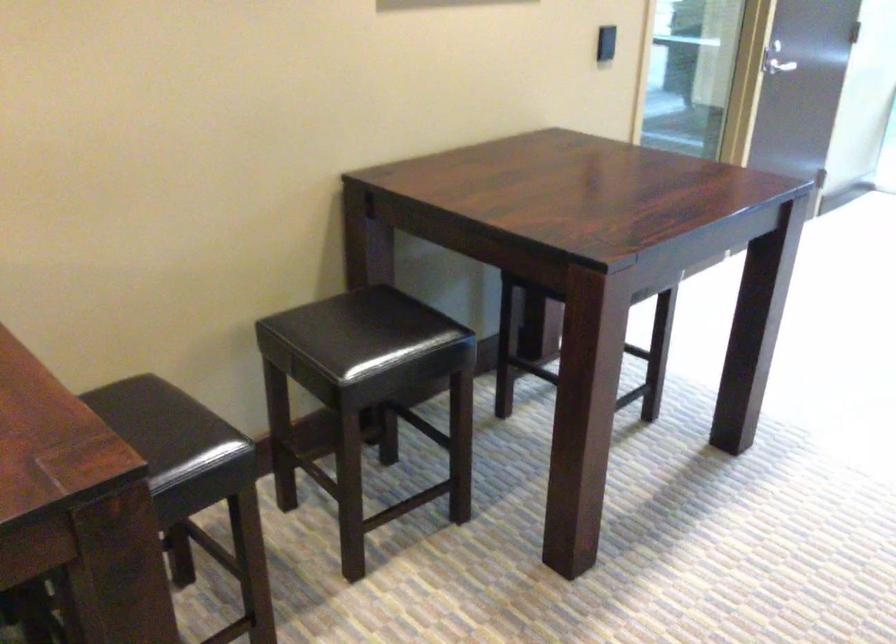
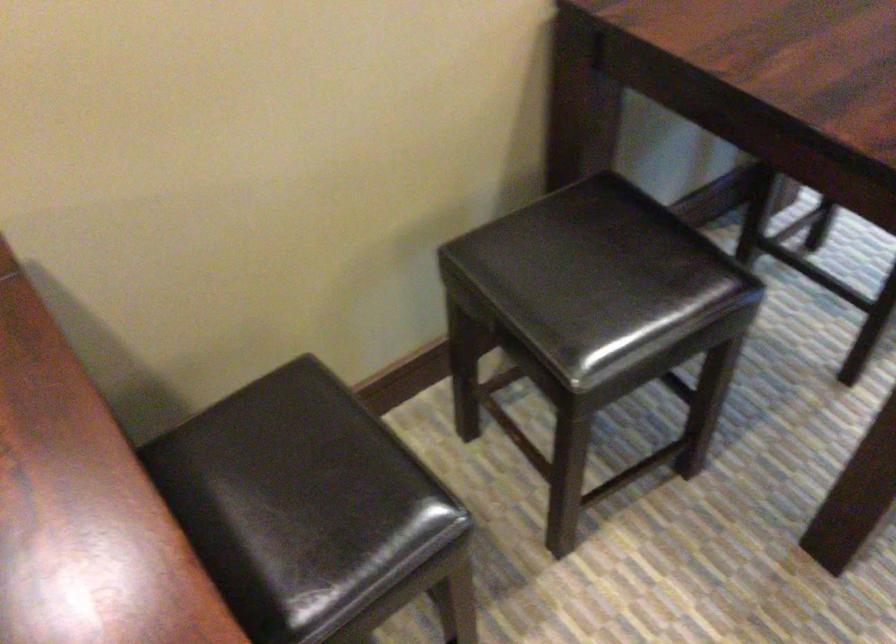
In a continuous first-person perspective shot, in which direction is the camera moving?

The cameraman moved toward left, forward.